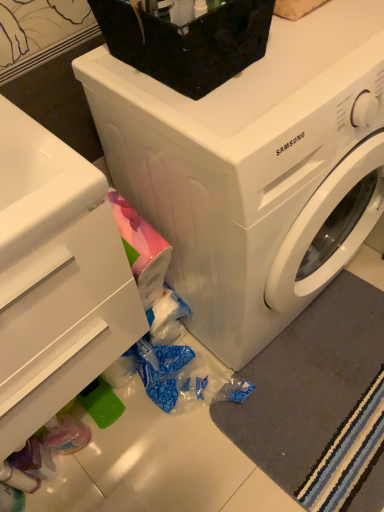
Question: Considering the relative sizes of white glossy washing machine at center and black plastic container at upper center in the image provided, is white glossy washing machine at center wider than black plastic container at upper center?

Choices:
 (A) yes
 (B) no

Answer: (A)

Question: Does white glossy washing machine at center have a smaller size compared to black plastic container at upper center?

Choices:
 (A) no
 (B) yes

Answer: (A)

Question: Does white glossy washing machine at center have a lesser height compared to black plastic container at upper center?

Choices:
 (A) no
 (B) yes

Answer: (A)

Question: From a real-world perspective, is white glossy washing machine at center over black plastic container at upper center?

Choices:
 (A) no
 (B) yes

Answer: (A)

Question: Is white glossy washing machine at center positioned beyond the bounds of black plastic container at upper center?

Choices:
 (A) yes
 (B) no

Answer: (A)

Question: Does white glossy washing machine at center appear on the left side of black plastic container at upper center?

Choices:
 (A) yes
 (B) no

Answer: (B)

Question: Is white glossy washing machine at center next to gray soft rug at lower right?

Choices:
 (A) no
 (B) yes

Answer: (A)

Question: From a real-world perspective, is white glossy washing machine at center positioned over gray soft rug at lower right based on gravity?

Choices:
 (A) yes
 (B) no

Answer: (A)

Question: Can you confirm if white glossy washing machine at center is thinner than gray soft rug at lower right?

Choices:
 (A) no
 (B) yes

Answer: (A)

Question: From the image's perspective, is white glossy washing machine at center located beneath gray soft rug at lower right?

Choices:
 (A) yes
 (B) no

Answer: (B)

Question: Does white glossy washing machine at center have a greater height compared to gray soft rug at lower right?

Choices:
 (A) no
 (B) yes

Answer: (B)

Question: Is white glossy washing machine at center turned away from gray soft rug at lower right?

Choices:
 (A) yes
 (B) no

Answer: (B)

Question: Does white glossy drawer at lower left have a lesser width compared to black plastic container at upper center?

Choices:
 (A) yes
 (B) no

Answer: (B)